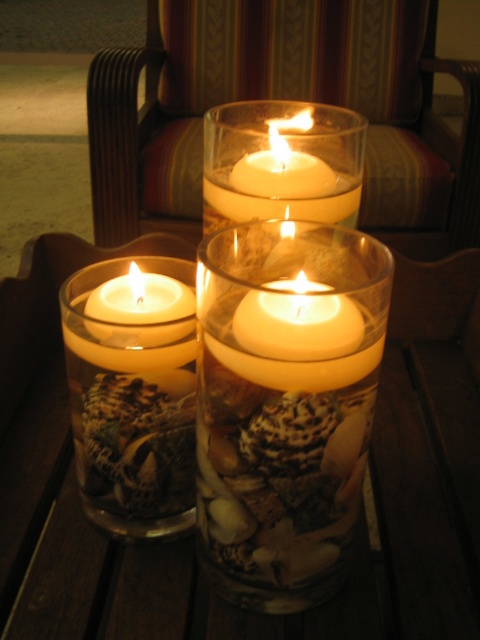
Question: Considering the relative positions of translucent glass vase at center and matte white candle at left in the image provided, where is translucent glass vase at center located with respect to matte white candle at left?

Choices:
 (A) right
 (B) left

Answer: (A)

Question: Which object is the closest to the matte white candle at center?

Choices:
 (A) matte white candle at left
 (B) white matte candle at center
 (C) translucent glass candle at center

Answer: (A)

Question: Is translucent glass vase at center below matte white candle at left?

Choices:
 (A) no
 (B) yes

Answer: (B)

Question: Which point appears closest to the camera in this image?

Choices:
 (A) (145, 310)
 (B) (324, 305)

Answer: (B)

Question: Which point is farther from the camera taking this photo?

Choices:
 (A) (275, 141)
 (B) (179, 6)

Answer: (B)

Question: Does translucent glass vase at center appear under wooden armchair at upper center?

Choices:
 (A) no
 (B) yes

Answer: (B)